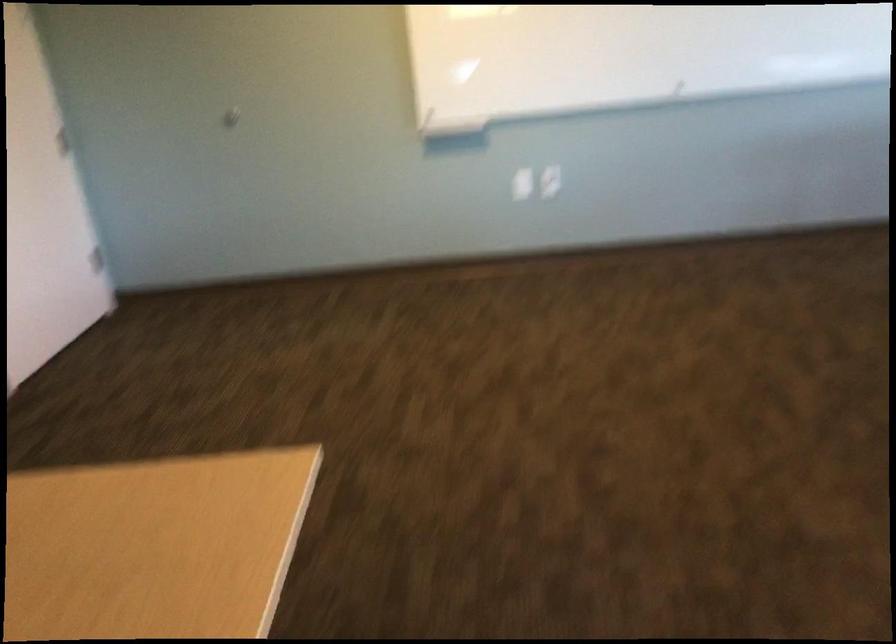
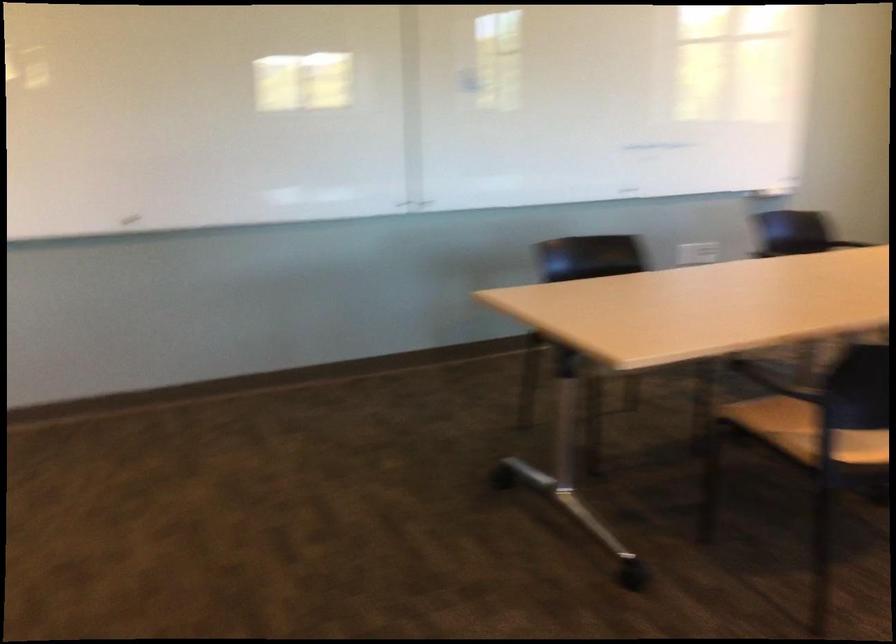
Question: The first image is from the beginning of the video and the second image is from the end. How did the camera likely rotate when shooting the video?

Choices:
 (A) Left
 (B) Right
 (C) Up
 (D) Down

Answer: (B)